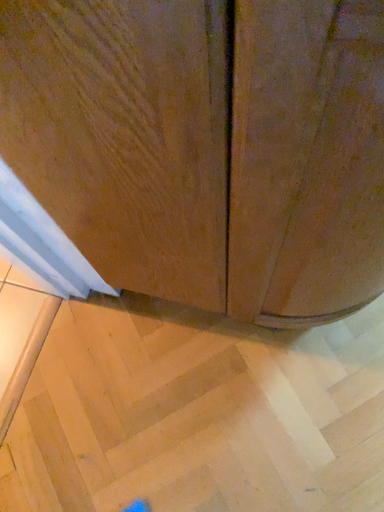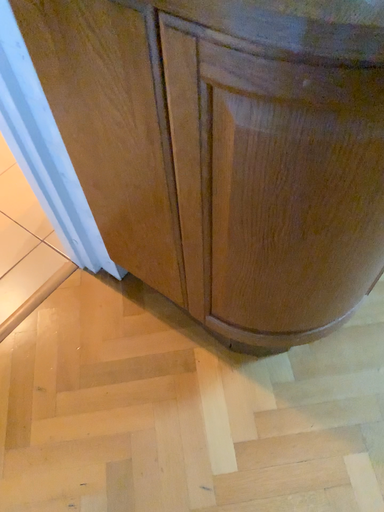
Question: How did the camera likely rotate when shooting the video?

Choices:
 (A) rotated left
 (B) rotated right

Answer: (A)